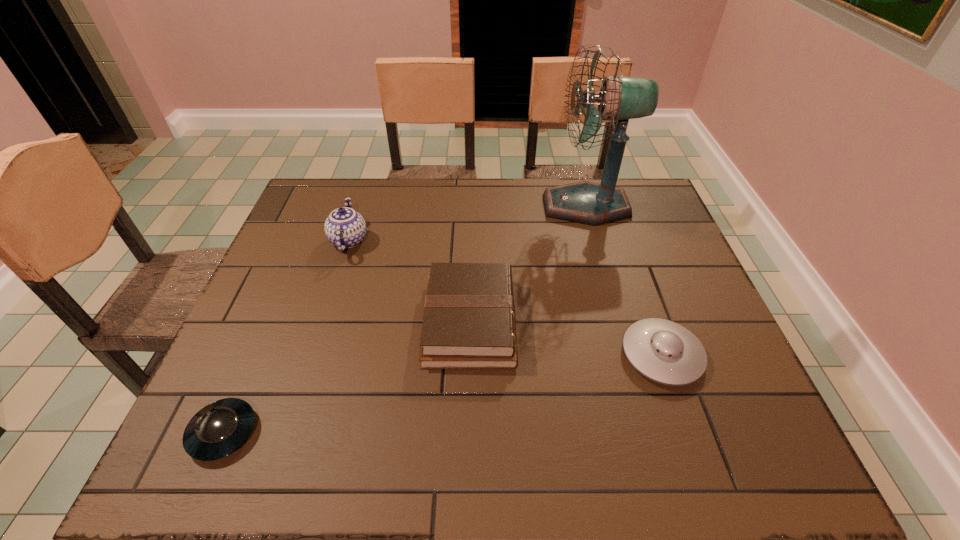
The width and height of the screenshot is (960, 540). I want to click on free space located 0.200m in front of the fan where the wind blows, so click(x=480, y=206).

This screenshot has height=540, width=960. Identify the location of blank space located in front of the fan where the wind blows. (425, 206).

At what (x,y) coordinates should I click in order to perform the action: click on free space located 0.070m at the spout of the second tallest object. Please return your answer as a coordinate pair (x, y). Image resolution: width=960 pixels, height=540 pixels. Looking at the image, I should click on (393, 240).

Identify the location of free region located 0.240m on the spine side of the Bible. (616, 321).

At what (x,y) coordinates should I click in order to perform the action: click on free space located 0.060m on the back of the right saucer. Please return your answer as a coordinate pair (x, y). Looking at the image, I should click on (644, 305).

Locate an element on the screen. This screenshot has width=960, height=540. free space located on the right of the shorter saucer is located at coordinates (396, 433).

Locate an element on the screen. Image resolution: width=960 pixels, height=540 pixels. fan that is at the far edge is located at coordinates (620, 98).

Identify the location of chinaware that is at the far edge. (345, 228).

At what (x,y) coordinates should I click in order to perform the action: click on object present at the near edge. Please return your answer as a coordinate pair (x, y). The width and height of the screenshot is (960, 540). Looking at the image, I should click on (220, 428).

Where is `chinaware at the left edge`? This screenshot has width=960, height=540. chinaware at the left edge is located at coordinates (345, 228).